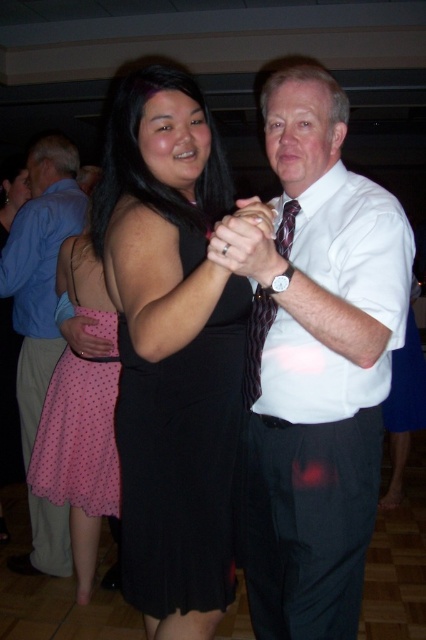
Is point (23, 568) in front of point (290, 214)?

No.

Identify the location of pink polka dot skirt at left. The image size is (426, 640). (40, 269).

What do you see at coordinates (172, 349) in the screenshot? I see `black satin dress at center` at bounding box center [172, 349].

In the scene shown: Does black satin dress at center appear on the right side of pink polka dot fabric skirt at left?

Indeed, black satin dress at center is positioned on the right side of pink polka dot fabric skirt at left.

Image resolution: width=426 pixels, height=640 pixels. I want to click on black satin dress at center, so click(172, 349).

The height and width of the screenshot is (640, 426). I want to click on black satin dress at center, so click(172, 349).

Based on the photo, can you confirm if white shirt at center is bigger than white smooth shirt at center?

Indeed, white shirt at center has a larger size compared to white smooth shirt at center.

What do you see at coordinates (316, 362) in the screenshot?
I see `white shirt at center` at bounding box center [316, 362].

This screenshot has width=426, height=640. In order to click on white shirt at center in this screenshot , I will do `click(316, 362)`.